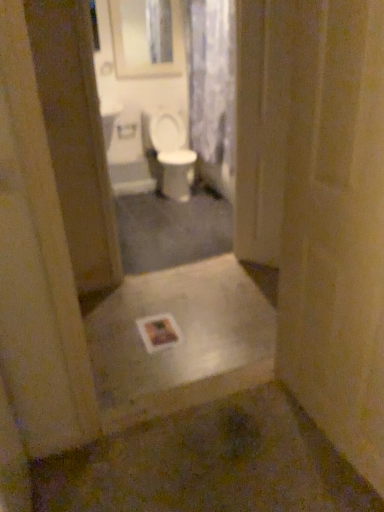
Question: From the image's perspective, is white matte toilet paper at center on translucent floral fabric at upper center?

Choices:
 (A) yes
 (B) no

Answer: (B)

Question: From the image's perspective, is white matte toilet paper at center located beneath translucent floral fabric at upper center?

Choices:
 (A) yes
 (B) no

Answer: (A)

Question: Would you say translucent floral fabric at upper center is part of white matte toilet paper at center's contents?

Choices:
 (A) no
 (B) yes

Answer: (A)

Question: Is white matte toilet paper at center placed right next to translucent floral fabric at upper center?

Choices:
 (A) no
 (B) yes

Answer: (A)

Question: Could you tell me if white matte toilet paper at center is turned towards translucent floral fabric at upper center?

Choices:
 (A) no
 (B) yes

Answer: (A)

Question: Considering the positions of metallic silver step at center and smooth cream door at right in the image, is metallic silver step at center taller or shorter than smooth cream door at right?

Choices:
 (A) short
 (B) tall

Answer: (A)

Question: Looking at their shapes, would you say metallic silver step at center is wider or thinner than smooth cream door at right?

Choices:
 (A) wide
 (B) thin

Answer: (A)

Question: Based on their positions, is metallic silver step at center located to the left or right of smooth cream door at right?

Choices:
 (A) right
 (B) left

Answer: (B)

Question: Is metallic silver step at center in front of or behind smooth cream door at right in the image?

Choices:
 (A) behind
 (B) front

Answer: (A)

Question: Is white glossy toilet at center situated inside translucent floral fabric at upper center or outside?

Choices:
 (A) outside
 (B) inside

Answer: (A)

Question: Visually, is white glossy toilet at center positioned to the left or to the right of translucent floral fabric at upper center?

Choices:
 (A) left
 (B) right

Answer: (A)

Question: Is white glossy toilet at center taller or shorter than translucent floral fabric at upper center?

Choices:
 (A) short
 (B) tall

Answer: (A)

Question: In the image, is white glossy toilet at center positioned in front of or behind translucent floral fabric at upper center?

Choices:
 (A) front
 (B) behind

Answer: (B)

Question: From a real-world perspective, is metallic silver step at center physically located above or below transparent plastic screen door at center?

Choices:
 (A) below
 (B) above

Answer: (A)

Question: From the image's perspective, relative to transparent plastic screen door at center, is metallic silver step at center above or below?

Choices:
 (A) below
 (B) above

Answer: (A)